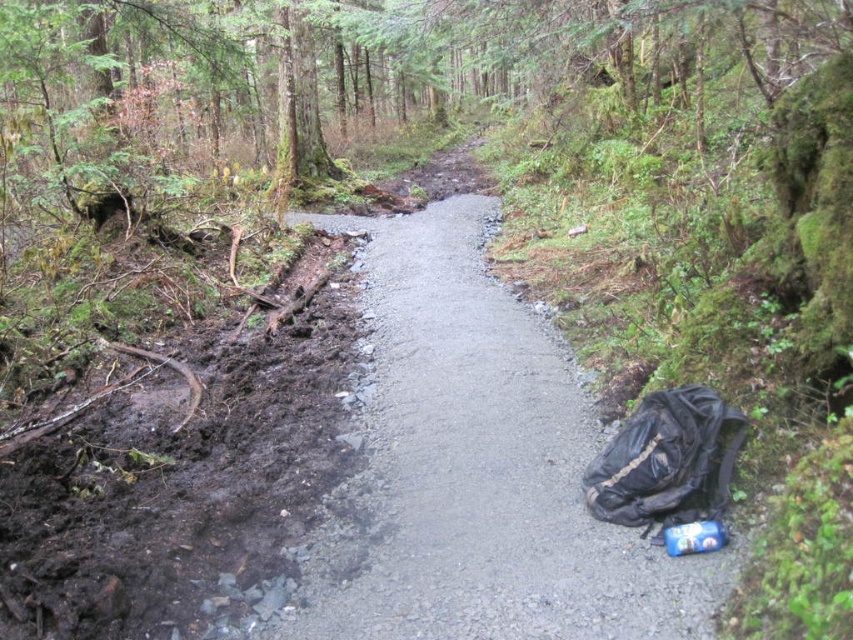
You are a hiker who just stepped onto the narrow gravel path in the forest. You see the dark brown mud at lower left and the black fabric backpack at lower right. Which object is closer to the left edge of the path?

The dark brown mud at lower left is closer to the left edge of the path because it is positioned on the left side of the black fabric backpack at lower right.

You are a hiker trying to navigate the muddy forest path. You notice the gray asphalt path at center and the dark brown mud at lower left. Which of these two areas is more suitable for walking to avoid getting your shoes dirty?

The gray asphalt path at center is more suitable for walking because it has a larger size compared to the dark brown mud at lower left, making it less likely to be muddy and slippery.